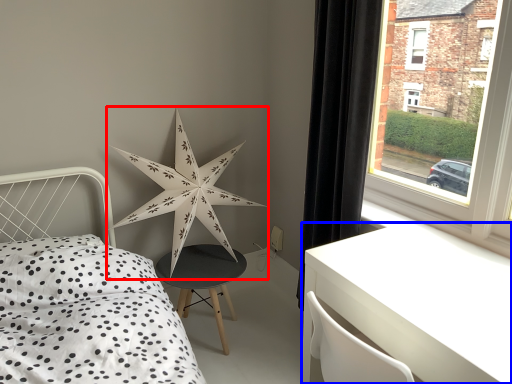
Question: Which object appears closest to the camera in this image, star (highlighted by a red box) or table (highlighted by a blue box)?

Choices:
 (A) star
 (B) table

Answer: (B)